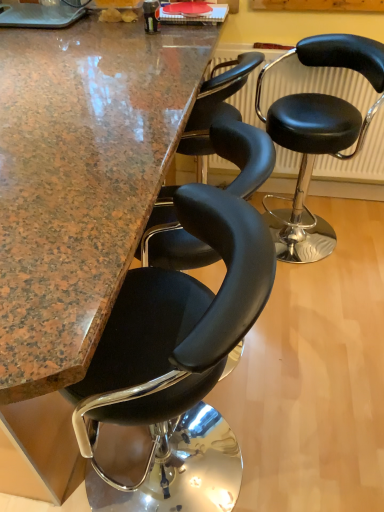
Question: In the image, is black leather stool at center, the first chair in the left-to-right sequence, on the left side or the right side of black leather stool at center, marked as the second chair in a left-to-right arrangement?

Choices:
 (A) left
 (B) right

Answer: (A)

Question: Is point (155, 302) closer or farther from the camera than point (380, 58)?

Choices:
 (A) farther
 (B) closer

Answer: (B)

Question: Estimate the real-world distances between objects in this image. Which object is closer to the black leather stool at center, arranged as the first chair when viewed from the front?

Choices:
 (A) black leather stool at center, placed as the first chair when sorted from back to front
 (B) granite countertop at center
 (C) black leather radiator at center

Answer: (B)

Question: Which of these objects is positioned closest to the granite countertop at center?

Choices:
 (A) black leather stool at center, the second chair when ordered from front to back
 (B) black leather radiator at center
 (C) black leather stool at center, arranged as the first chair when viewed from the front

Answer: (C)